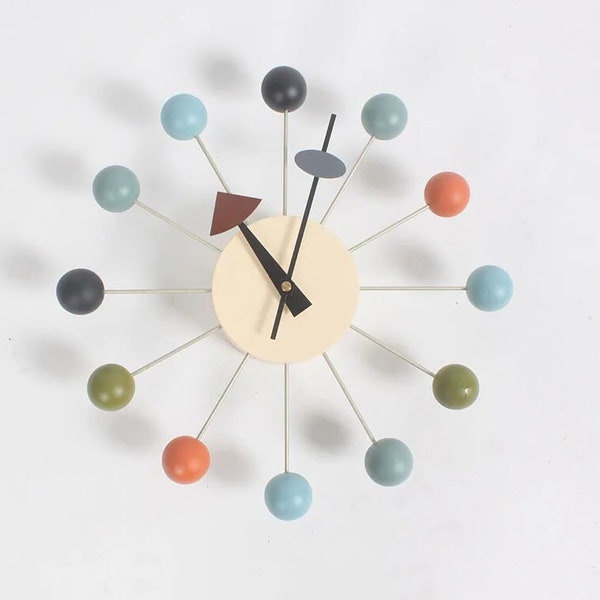
Where is `clock`? clock is located at coordinates (330, 293).